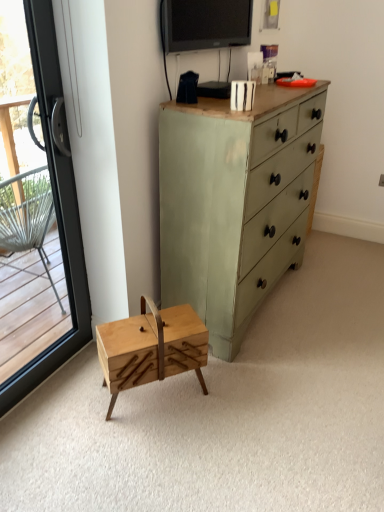
The image size is (384, 512). Identify the location of green painted wood chest of drawers at center. (234, 202).

This screenshot has width=384, height=512. What do you see at coordinates (60, 215) in the screenshot?
I see `transparent glass door at left` at bounding box center [60, 215].

The image size is (384, 512). Find the location of `natural wood sewing box at center`. natural wood sewing box at center is located at coordinates (151, 347).

Is the position of green painted wood chest of drawers at center less distant than that of matte black tv at upper center?

Yes, green painted wood chest of drawers at center is closer to the viewer.

From a real-world perspective, which is physically below, green painted wood chest of drawers at center or matte black tv at upper center?

From a 3D spatial view, green painted wood chest of drawers at center is below.

Does green painted wood chest of drawers at center turn towards matte black tv at upper center?

No, green painted wood chest of drawers at center is not turned towards matte black tv at upper center.

From the image's perspective, which one is positioned lower, green painted wood chest of drawers at center or matte black tv at upper center?

From the image's view, green painted wood chest of drawers at center is below.

The width and height of the screenshot is (384, 512). Identify the location of television above the transparent glass door at left (from the image's perspective). (205, 24).

Could you tell me if transparent glass door at left is facing matte black tv at upper center?

No, transparent glass door at left does not turn towards matte black tv at upper center.

In terms of height, does transparent glass door at left look taller or shorter compared to matte black tv at upper center?

transparent glass door at left is taller than matte black tv at upper center.

Is transparent glass door at left spatially inside green painted wood chest of drawers at center, or outside of it?

transparent glass door at left is not enclosed by green painted wood chest of drawers at center.

Who is smaller, transparent glass door at left or green painted wood chest of drawers at center?

With smaller size is transparent glass door at left.

Identify the location of window above the green painted wood chest of drawers at center (from a real-world perspective). This screenshot has height=512, width=384. (60, 215).

Is point (297, 167) positioned after point (46, 73)?

Yes.

From the image's perspective, is green painted wood chest of drawers at center above or below transparent glass door at left?

Based on their image positions, green painted wood chest of drawers at center is located above transparent glass door at left.

Does green painted wood chest of drawers at center have a greater height compared to transparent glass door at left?

No.

Considering the sizes of green painted wood chest of drawers at center and transparent glass door at left in the image, is green painted wood chest of drawers at center wider or thinner than transparent glass door at left?

Considering their sizes, green painted wood chest of drawers at center looks broader than transparent glass door at left.

Between matte black tv at upper center and natural wood sewing box at center, which one has less height?

matte black tv at upper center is shorter.

From the image's perspective, is matte black tv at upper center below natural wood sewing box at center?

Incorrect, from the image's perspective, matte black tv at upper center is higher than natural wood sewing box at center.

Based on the photo, is matte black tv at upper center positioned with its back to natural wood sewing box at center?

That's not correct — matte black tv at upper center is not looking away from natural wood sewing box at center.

Does point (189, 1) come in front of point (205, 352)?

No, (189, 1) is further to viewer.

Between matte black tv at upper center and green painted wood chest of drawers at center, which one has larger width?

green painted wood chest of drawers at center.

Is point (179, 51) closer to viewer compared to point (279, 250)?

Yes, it is.

From the image's perspective, between matte black tv at upper center and green painted wood chest of drawers at center, who is located below?

green painted wood chest of drawers at center is shown below in the image.

Considering the sizes of objects matte black tv at upper center and green painted wood chest of drawers at center in the image provided, who is bigger, matte black tv at upper center or green painted wood chest of drawers at center?

green painted wood chest of drawers at center.

Does point (76, 250) lie behind point (109, 412)?

Yes, point (76, 250) is behind point (109, 412).

Locate an element on the screen. The height and width of the screenshot is (512, 384). window in front of the natural wood sewing box at center is located at coordinates (60, 215).

Would you say transparent glass door at left is outside natural wood sewing box at center?

Yes, transparent glass door at left is not within natural wood sewing box at center.

Where is `television above the green painted wood chest of drawers at center (from the image's perspective)`? television above the green painted wood chest of drawers at center (from the image's perspective) is located at coordinates (205, 24).

Where is `television positioned vertically above the transparent glass door at left (from a real-world perspective)`? This screenshot has height=512, width=384. television positioned vertically above the transparent glass door at left (from a real-world perspective) is located at coordinates (205, 24).

From the image, which object appears to be farther from transparent glass door at left, green painted wood chest of drawers at center or natural wood sewing box at center?

Among the two, green painted wood chest of drawers at center is located further to transparent glass door at left.

When comparing their distances from transparent glass door at left, does natural wood sewing box at center or matte black tv at upper center seem closer?

natural wood sewing box at center is positioned closer to the anchor transparent glass door at left.

From the image, which object appears to be nearer to matte black tv at upper center, green painted wood chest of drawers at center or transparent glass door at left?

green painted wood chest of drawers at center is positioned closer to the anchor matte black tv at upper center.

Estimate the real-world distances between objects in this image. Which object is closer to matte black tv at upper center, transparent glass door at left or green painted wood chest of drawers at center?

green painted wood chest of drawers at center lies closer to matte black tv at upper center than the other object.

Looking at the image, which one is located closer to natural wood sewing box at center, matte black tv at upper center or transparent glass door at left?

transparent glass door at left lies closer to natural wood sewing box at center than the other object.

Looking at the image, which one is located further to matte black tv at upper center, green painted wood chest of drawers at center or natural wood sewing box at center?

natural wood sewing box at center is positioned further to the anchor matte black tv at upper center.

Considering their positions, is natural wood sewing box at center positioned further to green painted wood chest of drawers at center than transparent glass door at left?

transparent glass door at left is further to green painted wood chest of drawers at center.

Which object lies nearer to the anchor point green painted wood chest of drawers at center, transparent glass door at left or natural wood sewing box at center?

natural wood sewing box at center is closer to green painted wood chest of drawers at center.

Where is `television situated between transparent glass door at left and green painted wood chest of drawers at center from left to right`? The height and width of the screenshot is (512, 384). television situated between transparent glass door at left and green painted wood chest of drawers at center from left to right is located at coordinates (205, 24).

This screenshot has width=384, height=512. In order to click on window between matte black tv at upper center and natural wood sewing box at center in the up-down direction in this screenshot , I will do coord(60,215).

Where is `changing table located between transparent glass door at left and green painted wood chest of drawers at center in the left-right direction`? This screenshot has width=384, height=512. changing table located between transparent glass door at left and green painted wood chest of drawers at center in the left-right direction is located at coordinates (151, 347).

Locate an element on the screen. The width and height of the screenshot is (384, 512). the chest of drawers that lies between matte black tv at upper center and natural wood sewing box at center from top to bottom is located at coordinates (234, 202).